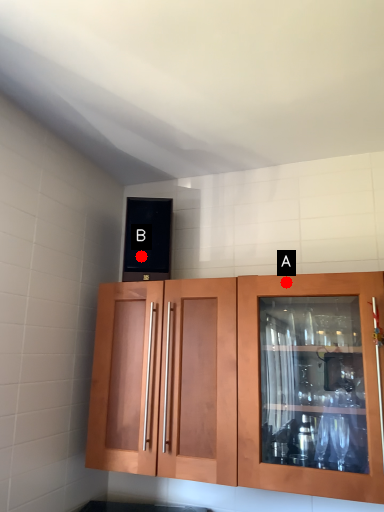
Question: Two points are circled on the image, labeled by A and B beside each circle. Which of the following is the closest to the observer?

Choices:
 (A) A is closer
 (B) B is closer

Answer: (A)